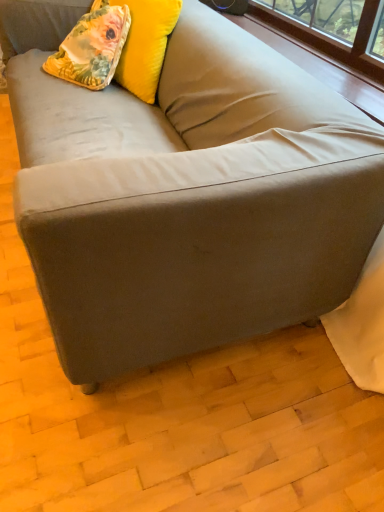
Question: In the image, is floral fabric pillow at upper left positioned in front of or behind floral fabric pillow at upper left?

Choices:
 (A) behind
 (B) front

Answer: (B)

Question: Is floral fabric pillow at upper left inside the boundaries of floral fabric pillow at upper left, or outside?

Choices:
 (A) outside
 (B) inside

Answer: (A)

Question: Is point (132, 87) closer or farther from the camera than point (124, 29)?

Choices:
 (A) farther
 (B) closer

Answer: (A)

Question: Is floral fabric pillow at upper left inside or outside of floral fabric pillow at upper left?

Choices:
 (A) inside
 (B) outside

Answer: (A)

Question: Considering the positions of floral fabric pillow at upper left and floral fabric pillow at upper left in the image, is floral fabric pillow at upper left wider or thinner than floral fabric pillow at upper left?

Choices:
 (A) thin
 (B) wide

Answer: (B)

Question: Considering the positions of floral fabric pillow at upper left and floral fabric pillow at upper left in the image, is floral fabric pillow at upper left bigger or smaller than floral fabric pillow at upper left?

Choices:
 (A) big
 (B) small

Answer: (B)

Question: Is point (124, 9) positioned closer to the camera than point (137, 40)?

Choices:
 (A) farther
 (B) closer

Answer: (B)